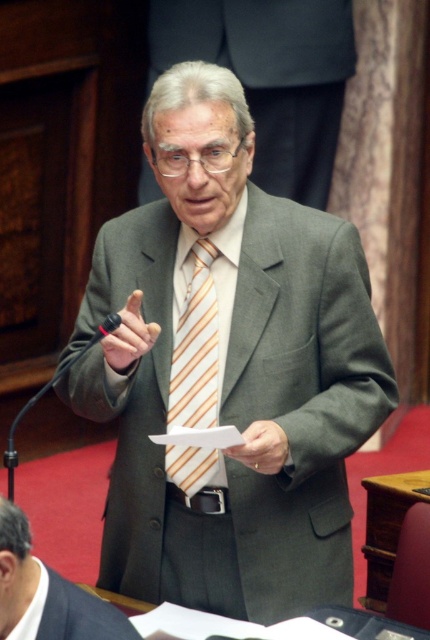
At what (x,y) coordinates should I click in order to perform the action: click on matte gray suit at center. Please return your answer as a coordinate pair (x, y). This screenshot has height=640, width=430. Looking at the image, I should click on (x=227, y=371).

Is matte gray suit at center above gray wool suit at center?

Actually, matte gray suit at center is below gray wool suit at center.

The height and width of the screenshot is (640, 430). What do you see at coordinates (227, 371) in the screenshot?
I see `matte gray suit at center` at bounding box center [227, 371].

Where is `matte gray suit at center`? matte gray suit at center is located at coordinates (227, 371).

Is gray wool suit at center to the left of striped fabric tie at center from the viewer's perspective?

Incorrect, gray wool suit at center is not on the left side of striped fabric tie at center.

Can you confirm if gray wool suit at center is positioned to the right of striped fabric tie at center?

Indeed, gray wool suit at center is positioned on the right side of striped fabric tie at center.

Is point (307, 108) positioned before point (211, 460)?

No, (307, 108) is behind (211, 460).

Locate an element on the screen. This screenshot has height=640, width=430. gray wool suit at center is located at coordinates (270, 76).

Who is positioned more to the left, matte gray suit at center or gray suit at center?

gray suit at center is more to the left.

Which is in front, point (202, 256) or point (3, 534)?

Point (3, 534)

This screenshot has width=430, height=640. I want to click on matte gray suit at center, so point(227,371).

Locate an element on the screen. Image resolution: width=430 pixels, height=640 pixels. matte gray suit at center is located at coordinates (227, 371).